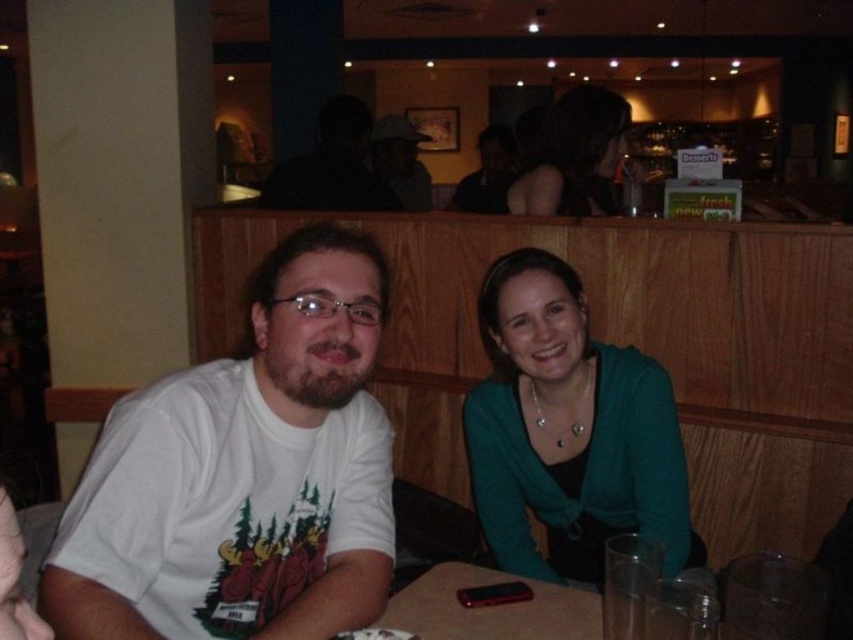
This screenshot has height=640, width=853. Describe the element at coordinates (566, 160) in the screenshot. I see `matte black shirt at upper center` at that location.

Does point (490, 208) come behind point (424, 189)?

No, it is not.

Measure the distance between point (527, 208) and camera.

Point (527, 208) and camera are 2.35 meters apart from each other.

Where is `matte black shirt at upper center`? Image resolution: width=853 pixels, height=640 pixels. matte black shirt at upper center is located at coordinates (566, 160).

Can you confirm if white t-shirt at left is positioned below matte black shirt at center?

Correct, white t-shirt at left is located below matte black shirt at center.

Who is more forward, (x=244, y=387) or (x=428, y=184)?

Point (x=244, y=387) is more forward.

In order to click on white t-shirt at left in this screenshot , I will do tap(244, 476).

Consider the image. Who is lower down, white t-shirt at left or matte black hair at upper center?

white t-shirt at left is lower down.

Which is behind, point (299, 401) or point (534, 202)?

The point (534, 202) is more distant.

I want to click on white t-shirt at left, so click(x=244, y=476).